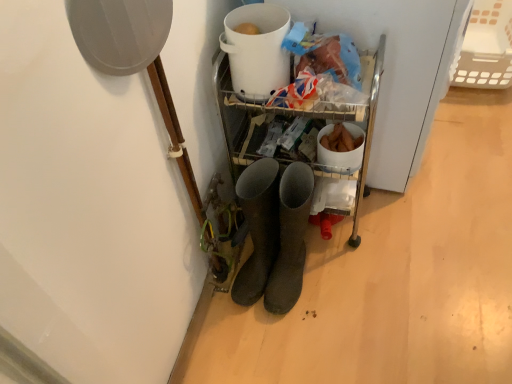
Identify the location of spots to the right of dark gray rubber boots at center. (351, 276).